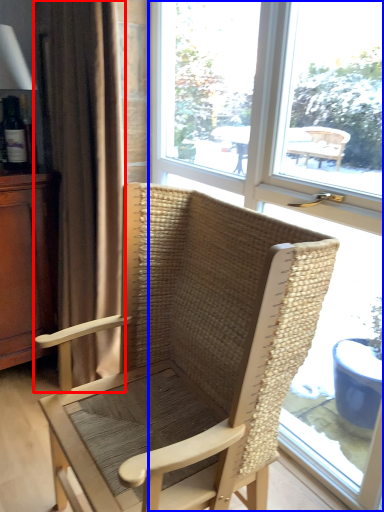
Question: Which object appears closest to the camera in this image, curtain (highlighted by a red box) or window (highlighted by a blue box)?

Choices:
 (A) curtain
 (B) window

Answer: (B)